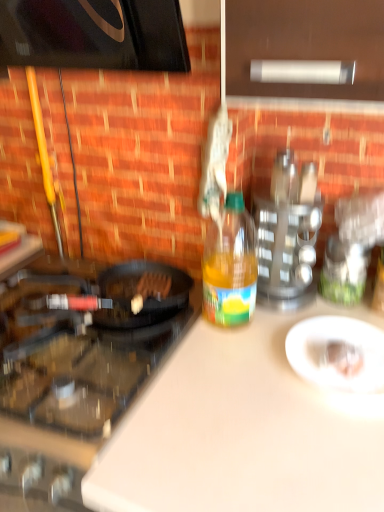
Where is `vacant space that is to the left of white glossy plate at center`? The image size is (384, 512). vacant space that is to the left of white glossy plate at center is located at coordinates (276, 395).